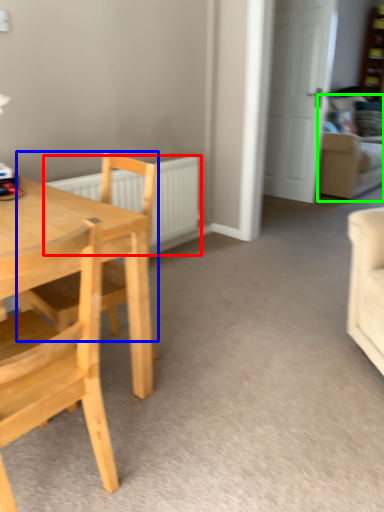
Question: Considering the real-world distances, which object is farthest from radiator (highlighted by a red box)? chair (highlighted by a blue box) or couch (highlighted by a green box)?

Choices:
 (A) chair
 (B) couch

Answer: (B)